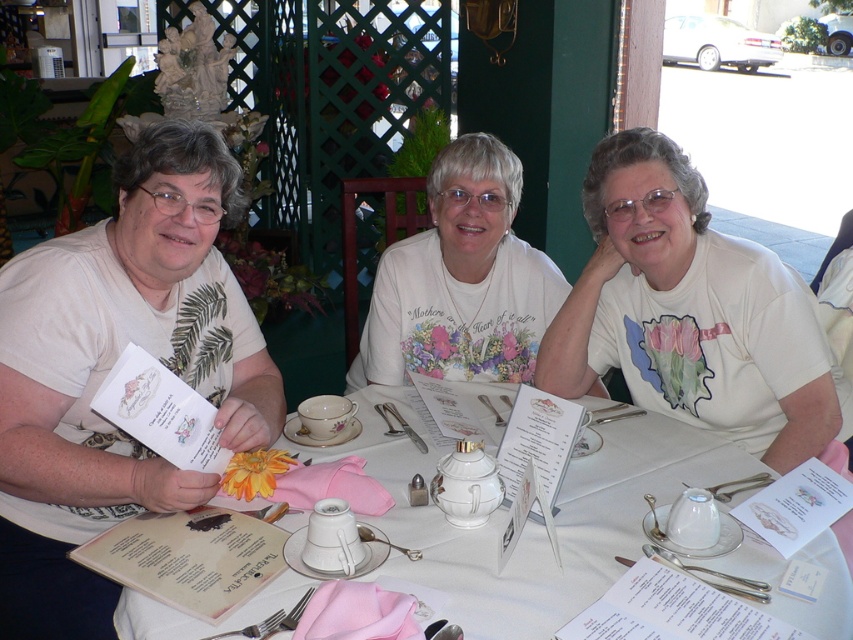
You are a server at the outdoor dining area. You need to deliver a dessert to the customer seated at the table where both the white printed menu at left and the white floral shirt at center are present. The dessert needs to be placed on the table. To ensure you don not accidentally place it on the menu, which object should you place the dessert behind?

The dessert should be placed behind the white printed menu at left because it is in front of the white floral shirt at center, so placing it behind the menu ensures it is on the table without covering the menu.

You are a waiter at the outdoor dining area. You need to place a new sugar bowl on the table between the white matte shirt at center and the white porcelain teapot at center. Based on their positions, which object should the sugar bowl be closer to?

The white matte shirt at center is positioned on the right side of the white porcelain teapot at center, so the sugar bowl should be placed closer to the white porcelain teapot at center to maintain the existing arrangement.

You are a waiter at the outdoor dining area. You need to deliver a dessert menu to the customer seated at the table. The dessert menu is the same size as the white printed menu at left. Will the dessert menu also be larger than the white floral shirt at center?

Yes, the dessert menu will also be larger than the white floral shirt at center because the white printed menu at left, which is the same size as the dessert menu, is larger in size than the white floral shirt at center.